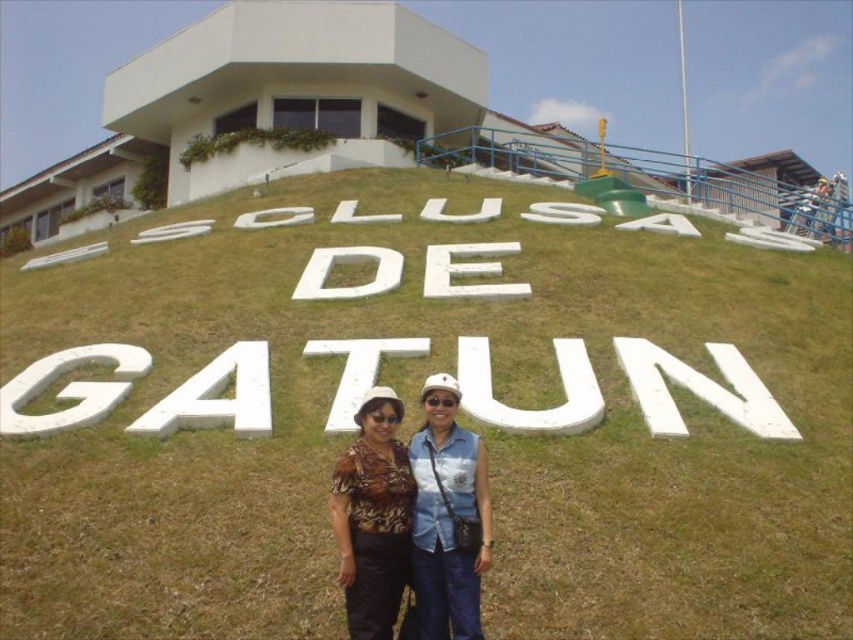
You are a photographer trying to capture a photo of the ESCOLUSAS DE GATUN sign. You notice two items in the frame that might distract from the sign. Which object is closer to the camera between the green grassy at center and the printed fabric shirt at center?

The printed fabric shirt at center is closer to the camera because the green grassy at center is located above it, meaning the shirt is in front.

You are a drone operator trying to capture a photo of the large white sign at the Esclusas de Gatun. Your drone is currently hovering above the green grassy area at center. To get the best shot, you need to move the drone directly towards the sign. In which direction should you move the drone from the green grassy at center to face the sign?

The green grassy at center is located at point (415, 424). Since the sign is mounted on the grassy hill in front of the individuals, moving the drone northwards from the green grassy at center would direct it towards the sign for the best shot.